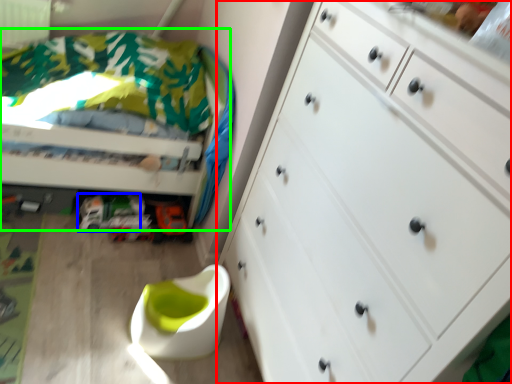
Question: Estimate the real-world distances between objects in this image. Which object is closer to chest of drawers (highlighted by a red box), toy car (highlighted by a blue box) or bed (highlighted by a green box)?

Choices:
 (A) toy car
 (B) bed

Answer: (B)